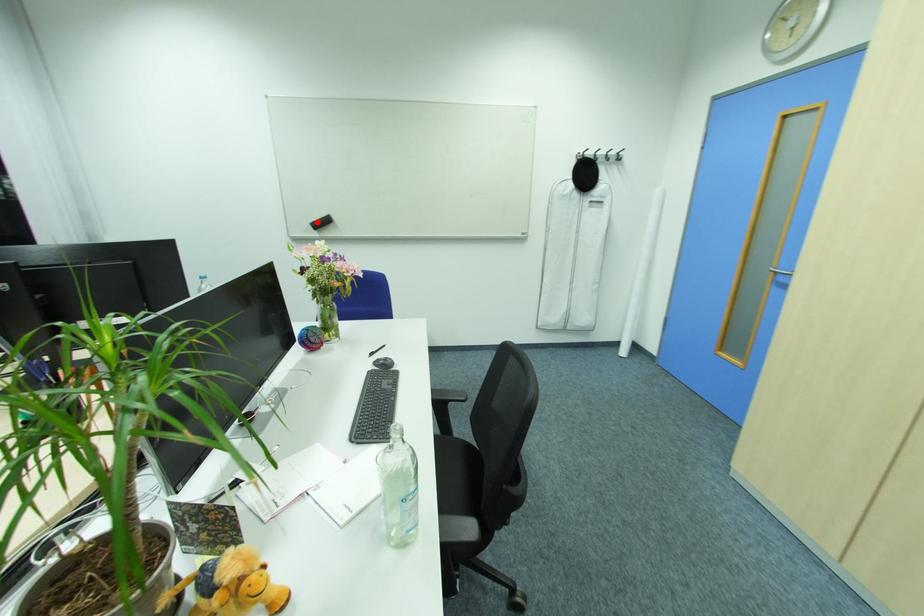
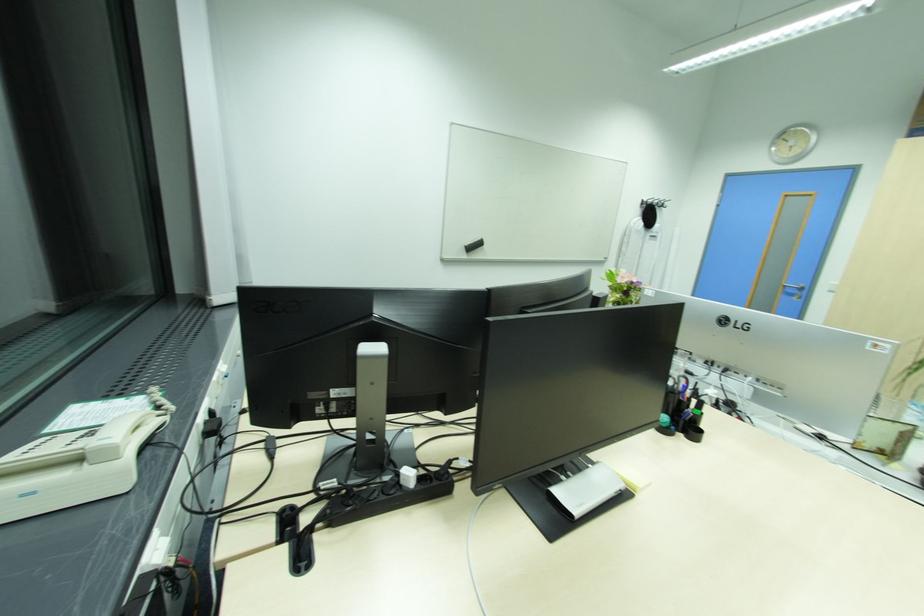
Locate, in the second image, the point that corresponds to the highlighted location in the first image.

(470, 245)